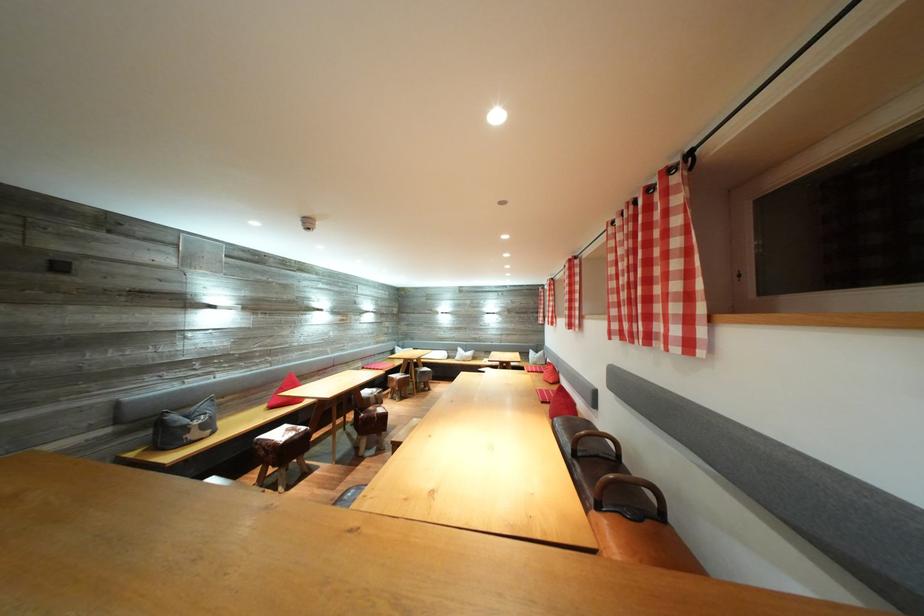
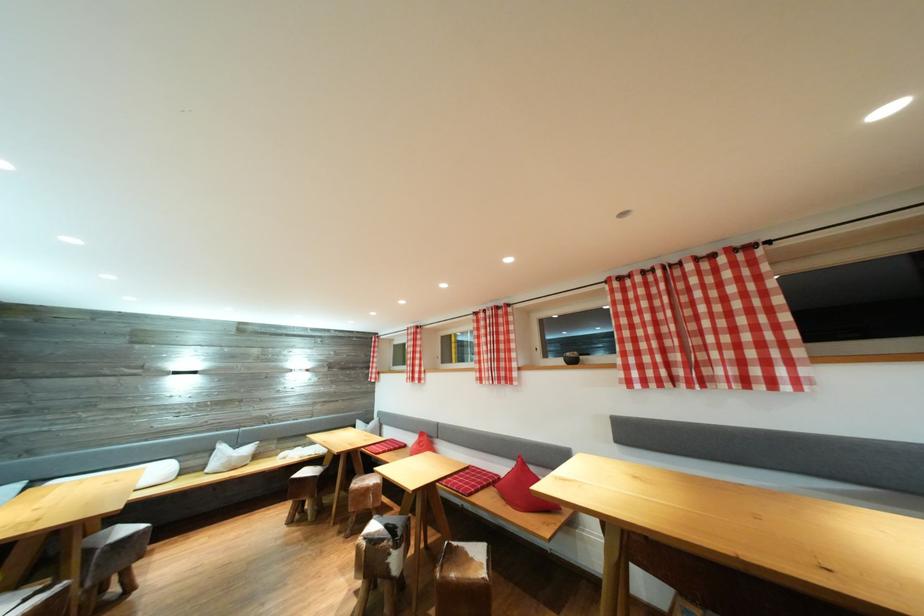
Where in the second image is the point corresponding to (x=578, y=322) from the first image?

(505, 374)